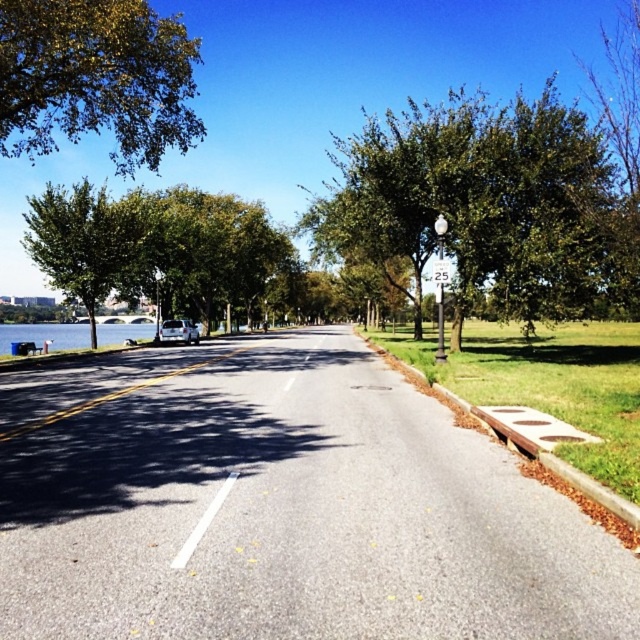
Who is shorter, green leafy tree at upper left or green plastic sign at center?

With less height is green plastic sign at center.

Consider the image. Can you confirm if green leafy tree at upper left is positioned below green plastic sign at center?

Actually, green leafy tree at upper left is above green plastic sign at center.

Identify the location of green leafy tree at upper left. (96, 77).

Locate an element on the screen. green leafy tree at upper left is located at coordinates (96, 77).

Between green leafy tree at center and white plastic sign at center, which one appears on the right side from the viewer's perspective?

green leafy tree at center is more to the right.

Does point (369, 262) come farther from viewer compared to point (438, 269)?

Yes, point (369, 262) is farther from viewer.

At what (x,y) coordinates should I click in order to perform the action: click on green leafy tree at center. Please return your answer as a coordinate pair (x, y). This screenshot has height=640, width=640. Looking at the image, I should click on pyautogui.click(x=480, y=202).

Which is in front, point (113, 76) or point (65, 256)?

Positioned in front is point (113, 76).

From the picture: Which is more to the left, green leafy tree at upper left or green leafy tree at left?

Positioned to the left is green leafy tree at left.

Which is in front, point (84, 99) or point (76, 291)?

Point (84, 99) is in front.

Locate an element on the screen. The width and height of the screenshot is (640, 640). green leafy tree at upper left is located at coordinates (96, 77).